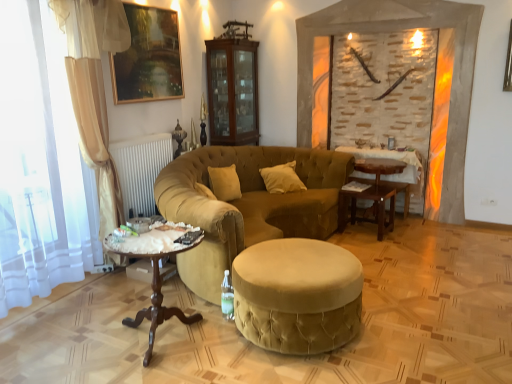
In order to click on vacant space underneath wooden polished table at lower left (from a real-world perspective) in this screenshot , I will do coord(164,337).